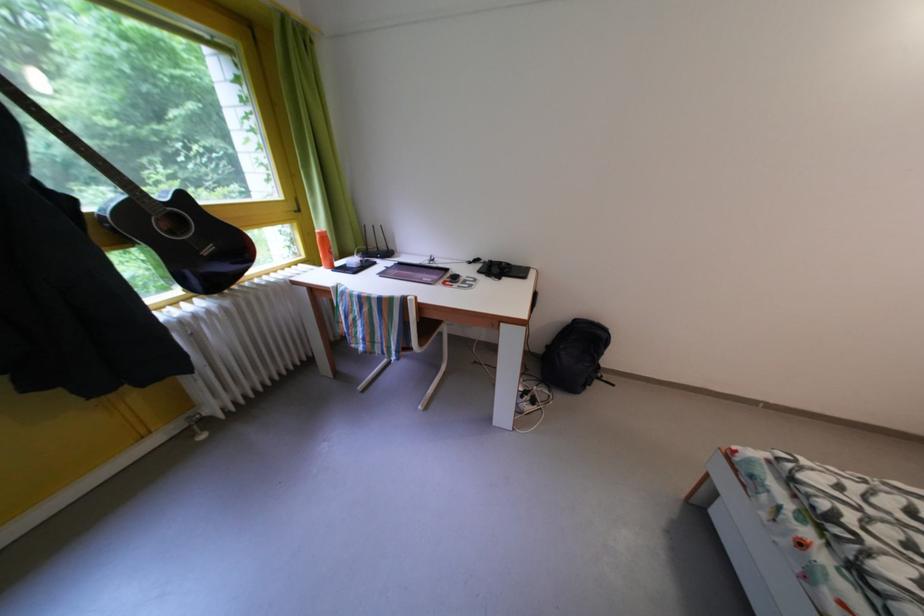
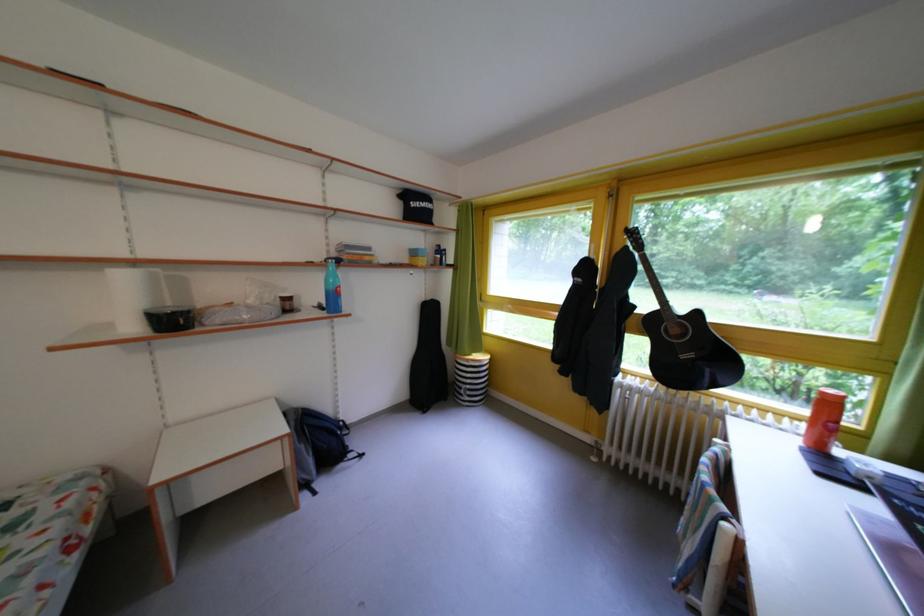
In the second image, find the point that corresponds to (191,203) in the first image.

(707, 320)